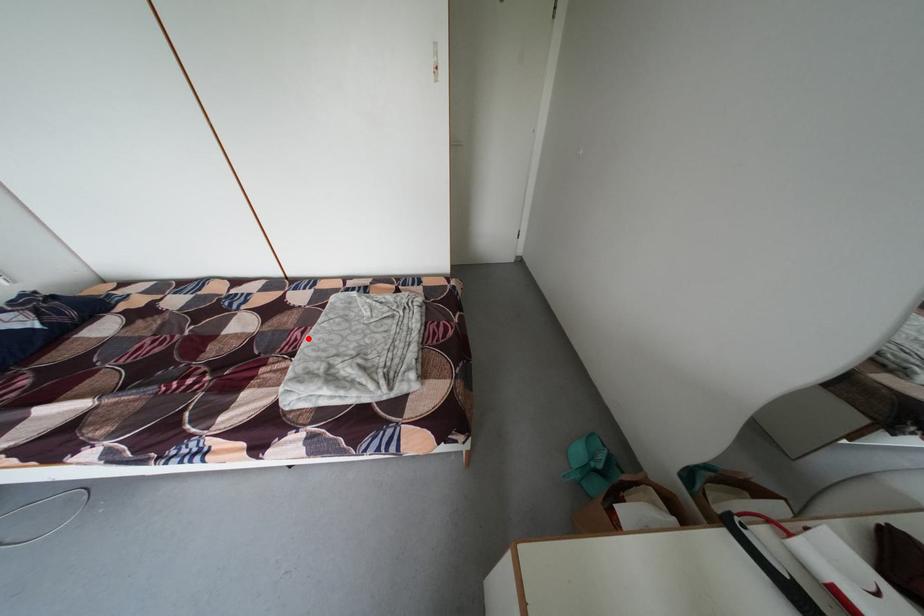
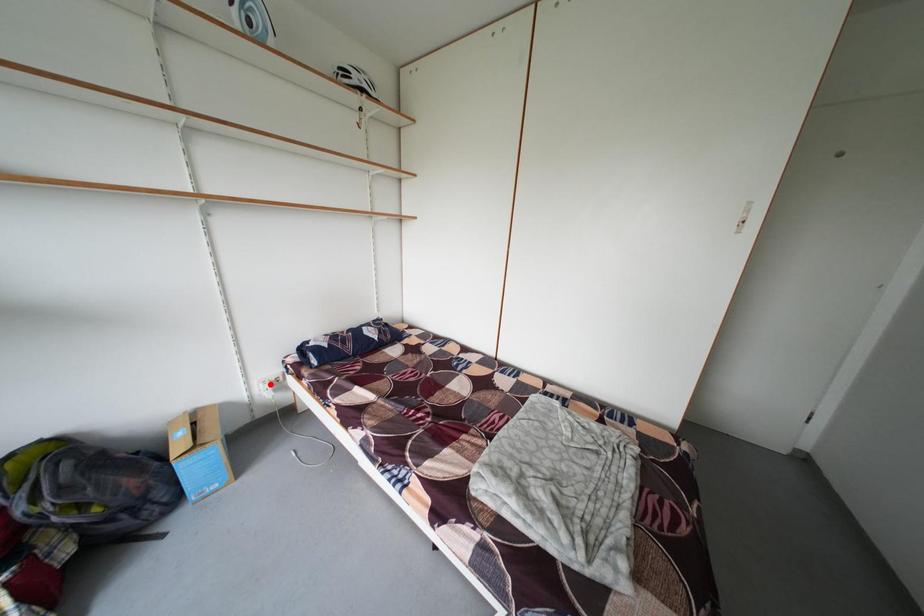
I am providing you with two images of the same scene from different viewpoints. A red point is marked on the first image and another point is marked on the second image. Do the highlighted points in image1 and image2 indicate the same real-world spot?

No